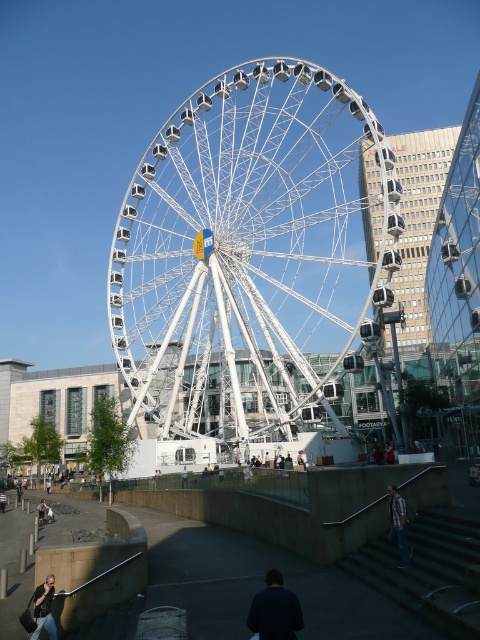
You are standing in front of the Ferris wheel and see both the light brown leather jacket at center and the light brown wooden bench at center. Which object is nearer to you?

The light brown leather jacket at center is closer to the viewer than the light brown wooden bench at center.